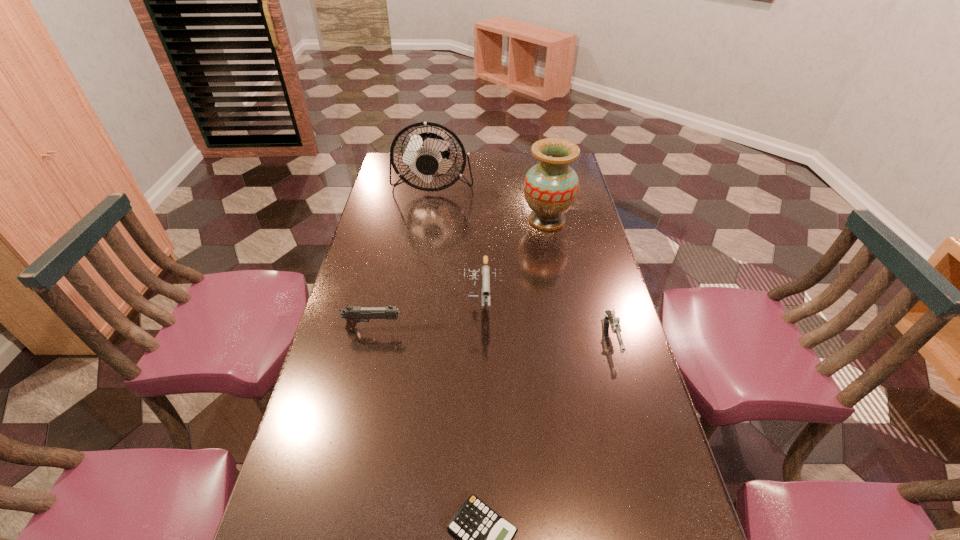
Find the location of a particular element. The image size is (960, 540). vacant position located 0.330m on the back of the fifth nearest object is located at coordinates (537, 165).

Where is `vacant area located at the barrel end of the tallest gun`? Image resolution: width=960 pixels, height=540 pixels. vacant area located at the barrel end of the tallest gun is located at coordinates (480, 412).

The image size is (960, 540). In order to click on free space located in the direction the leftmost gun is aimed in this screenshot , I will do `click(517, 330)`.

Where is `vacant space situated aimed along the barrel of the shortest gun`? The image size is (960, 540). vacant space situated aimed along the barrel of the shortest gun is located at coordinates (631, 401).

The width and height of the screenshot is (960, 540). I want to click on object present at the far edge, so click(425, 154).

Where is `fan that is positioned at the left edge`? fan that is positioned at the left edge is located at coordinates (425, 154).

The height and width of the screenshot is (540, 960). I want to click on gun that is at the left edge, so click(353, 314).

Find the location of a particular element. vase positioned at the right edge is located at coordinates (551, 187).

Where is `gun at the right edge`? gun at the right edge is located at coordinates (614, 321).

Locate an element on the screen. object that is positioned at the far left corner is located at coordinates (425, 154).